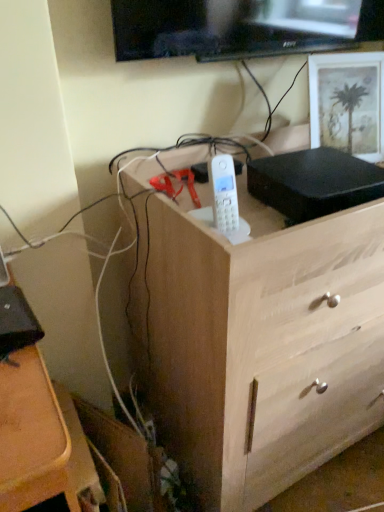
Question: Is wooden chest of drawers at center facing towards white matte picture frame at upper right?

Choices:
 (A) yes
 (B) no

Answer: (B)

Question: Is wooden chest of drawers at center to the right of white matte picture frame at upper right from the viewer's perspective?

Choices:
 (A) no
 (B) yes

Answer: (A)

Question: Considering the relative positions of wooden chest of drawers at center and white matte picture frame at upper right in the image provided, is wooden chest of drawers at center behind white matte picture frame at upper right?

Choices:
 (A) no
 (B) yes

Answer: (A)

Question: Is white matte picture frame at upper right inside wooden chest of drawers at center?

Choices:
 (A) no
 (B) yes

Answer: (A)

Question: Is wooden chest of drawers at center thinner than white matte picture frame at upper right?

Choices:
 (A) yes
 (B) no

Answer: (B)

Question: From the image's perspective, is wooden chest of drawers at center located beneath white matte picture frame at upper right?

Choices:
 (A) yes
 (B) no

Answer: (A)

Question: Is the position of white matte picture frame at upper right less distant than that of wooden chest of drawers at center?

Choices:
 (A) yes
 (B) no

Answer: (B)

Question: Does white matte picture frame at upper right have a larger size compared to wooden chest of drawers at center?

Choices:
 (A) no
 (B) yes

Answer: (A)

Question: Is white matte picture frame at upper right facing away from wooden chest of drawers at center?

Choices:
 (A) yes
 (B) no

Answer: (B)

Question: From a real-world perspective, does white matte picture frame at upper right sit lower than wooden chest of drawers at center?

Choices:
 (A) no
 (B) yes

Answer: (A)

Question: Does white matte picture frame at upper right have a greater height compared to wooden chest of drawers at center?

Choices:
 (A) no
 (B) yes

Answer: (A)

Question: Is white matte picture frame at upper right aimed at wooden chest of drawers at center?

Choices:
 (A) no
 (B) yes

Answer: (A)

Question: Is point (329, 64) closer or farther from the camera than point (337, 279)?

Choices:
 (A) farther
 (B) closer

Answer: (A)